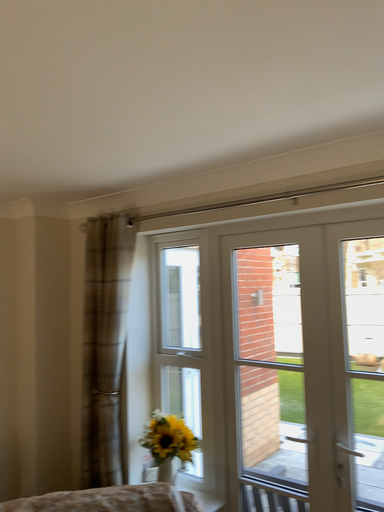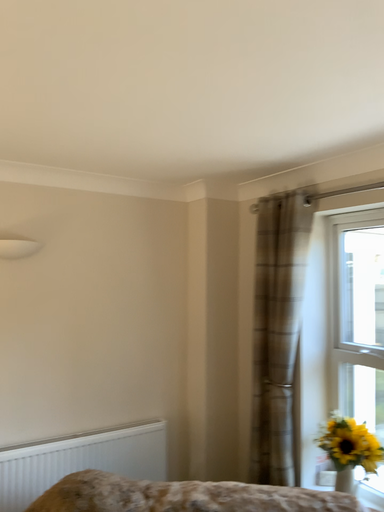
Question: How did the camera likely rotate when shooting the video?

Choices:
 (A) rotated right
 (B) rotated left

Answer: (B)